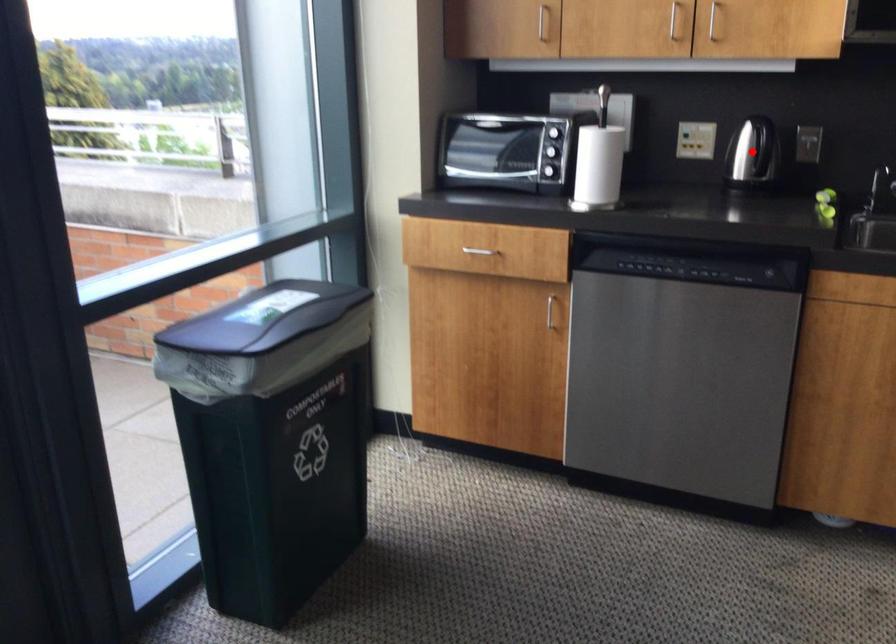
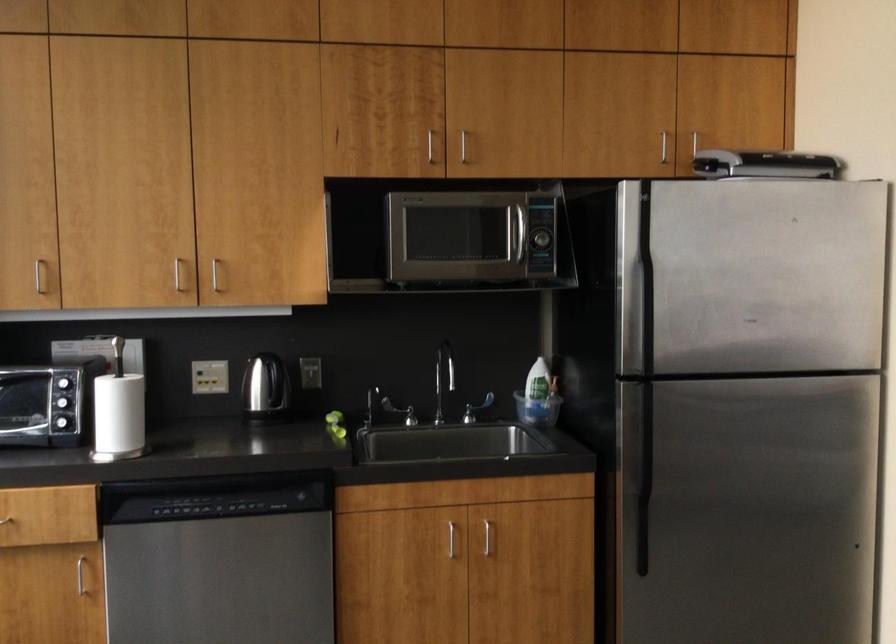
The point at the highlighted location is marked in the first image. Where is the corresponding point in the second image?

(266, 391)